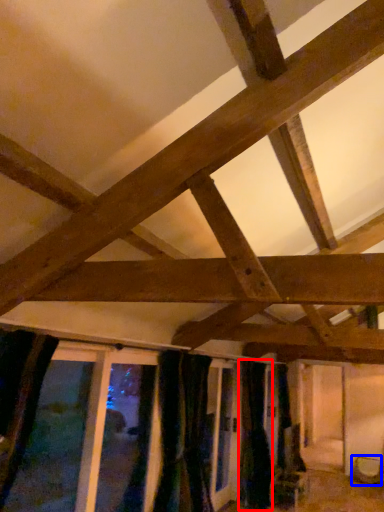
Question: Which of the following is the closest to the observer, curtain (highlighted by a red box) or furniture (highlighted by a blue box)?

Choices:
 (A) curtain
 (B) furniture

Answer: (A)